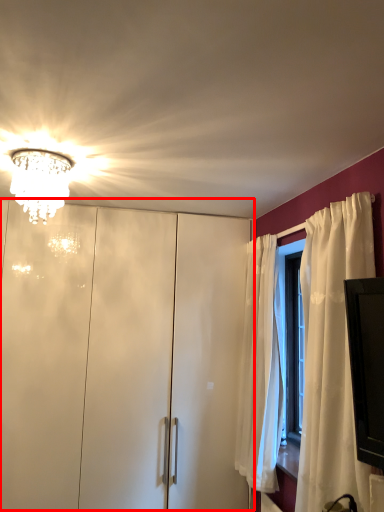
Question: From the image's perspective, what is the correct spatial relationship of dresser (annotated by the red box) in relation to lamp?

Choices:
 (A) below
 (B) above

Answer: (A)